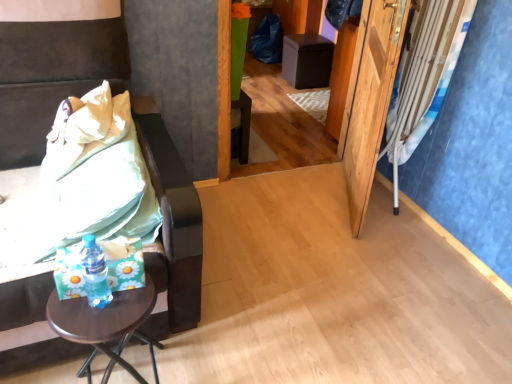
At what (x,y) coordinates should I click in order to perform the action: click on empty space that is in between brown wooden side table at left, the first furniture in the bottom-to-top sequence, and wooden screen door at right. Please return your answer as a coordinate pair (x, y). This screenshot has height=384, width=512. Looking at the image, I should click on (271, 229).